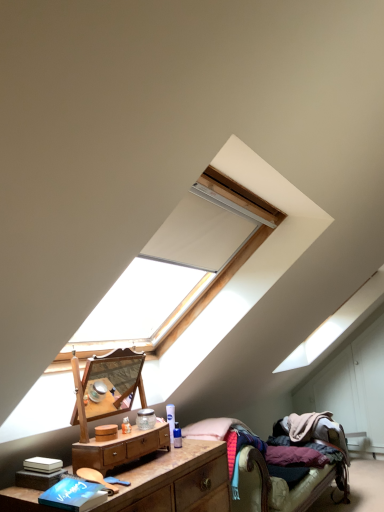
Question: Is blue matte book at lower left bigger or smaller than wooden polished nightstand at center, the first nightstand in the top-to-bottom sequence?

Choices:
 (A) big
 (B) small

Answer: (B)

Question: From a real-world perspective, is blue matte book at lower left physically located above or below wooden polished nightstand at center, the 2th nightstand ordered from the bottom?

Choices:
 (A) above
 (B) below

Answer: (B)

Question: Which is nearer to the wooden nightstand at lower left, the second nightstand viewed from the top?

Choices:
 (A) blue matte book at lower left
 (B) wooden polished nightstand at center, the 2th nightstand ordered from the bottom
 (C) textured fabric bed at lower right

Answer: (B)

Question: Estimate the real-world distances between objects in this image. Which object is farther from the wooden nightstand at lower left, the second nightstand viewed from the top?

Choices:
 (A) wooden polished nightstand at center, the 2th nightstand ordered from the bottom
 (B) blue matte book at lower left
 (C) textured fabric bed at lower right

Answer: (C)